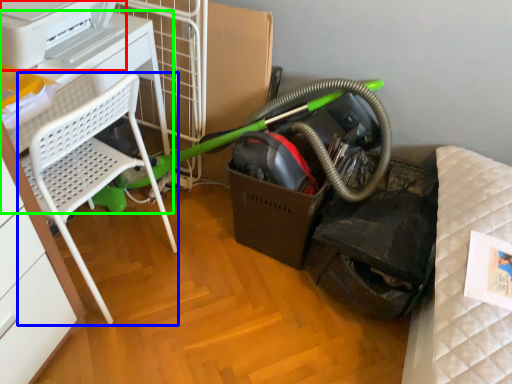
Question: Which is nearer to the printer (highlighted by a red box)? furniture (highlighted by a blue box) or table (highlighted by a green box).

Choices:
 (A) furniture
 (B) table

Answer: (B)